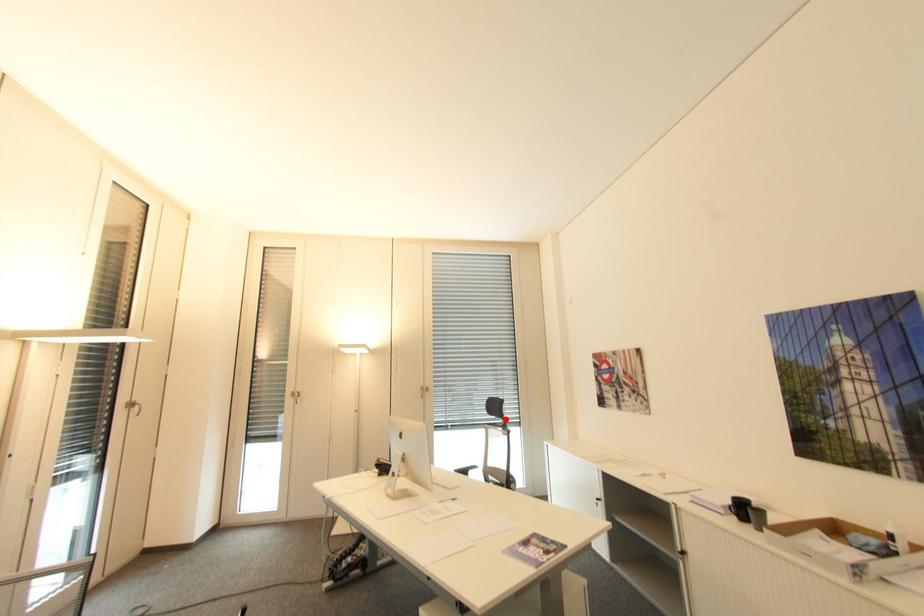
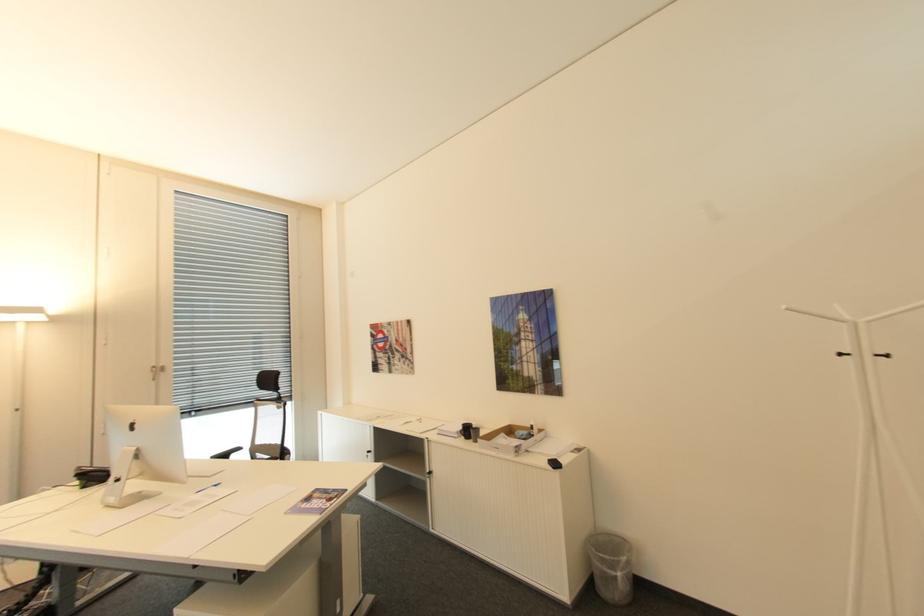
The point at the highlighted location is marked in the first image. Where is the corresponding point in the second image?

(280, 392)